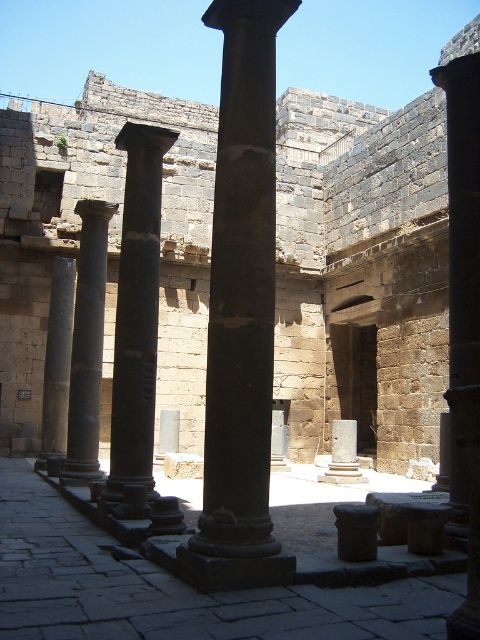
Question: From the image, what is the correct spatial relationship of black polished column at center in relation to dark gray stone column at left?

Choices:
 (A) below
 (B) above

Answer: (B)

Question: Can you confirm if black polished column at center is bigger than dark gray stone column at center?

Choices:
 (A) yes
 (B) no

Answer: (A)

Question: Which point is farther to the camera?

Choices:
 (A) (200, 564)
 (B) (48, 362)

Answer: (B)

Question: Does black polished column at right appear under dark gray stone column at left?

Choices:
 (A) no
 (B) yes

Answer: (A)

Question: Which point is closer to the camera?

Choices:
 (A) (x=456, y=70)
 (B) (x=72, y=340)
 (C) (x=274, y=22)
 (D) (x=156, y=163)

Answer: (C)

Question: Which point appears farthest from the camera in this image?

Choices:
 (A) (62, 390)
 (B) (133, 232)
 (C) (452, 198)
 (D) (100, 342)

Answer: (A)